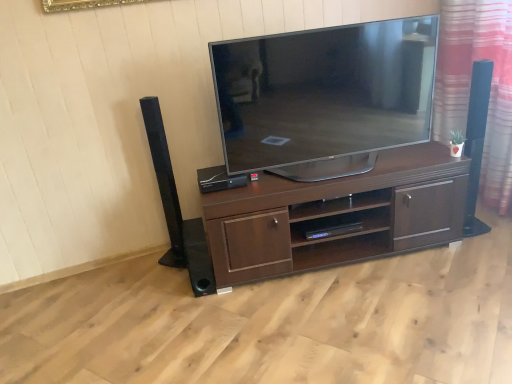
Where is `vacant area located to the right-hand side of velvet-like red curtain at right`? vacant area located to the right-hand side of velvet-like red curtain at right is located at coordinates (492, 217).